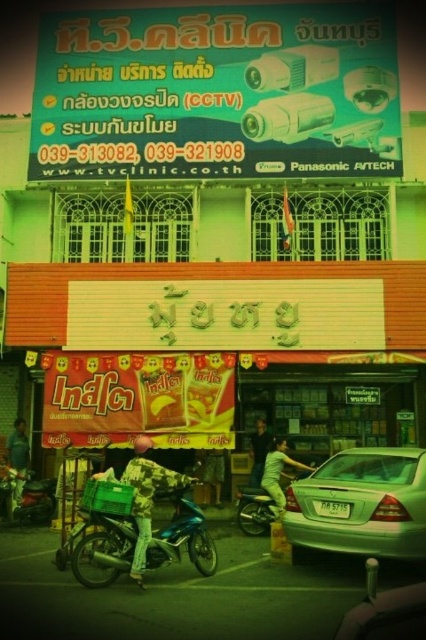
Who is more forward, (11, 515) or (308, 472)?

Point (11, 515) is more forward.

Is point (49, 506) in front of point (252, 493)?

No.

Where is `metallic blue motorcycle at lower left`? The height and width of the screenshot is (640, 426). metallic blue motorcycle at lower left is located at coordinates tap(26, 497).

Who is higher up, metallic silver motorcycle at center or camouflage jacket at lower left?

Positioned higher is camouflage jacket at lower left.

Between metallic silver motorcycle at center and camouflage jacket at lower left, which one is positioned lower?

metallic silver motorcycle at center

At what (x,y) coordinates should I click in order to perform the action: click on metallic silver motorcycle at center. Please return your answer as a coordinate pair (x, y). Looking at the image, I should click on (256, 509).

This screenshot has height=640, width=426. In order to click on metallic silver motorcycle at center in this screenshot , I will do `click(256, 509)`.

Who is positioned more to the right, teal metallic motorcycle at center or metallic blue motorcycle at lower left?

teal metallic motorcycle at center is more to the right.

Looking at this image, is teal metallic motorcycle at center above metallic blue motorcycle at lower left?

A: No, teal metallic motorcycle at center is not above metallic blue motorcycle at lower left.

Which is in front, point (166, 493) or point (5, 472)?

Point (166, 493) is in front.

Where is `teal metallic motorcycle at center`? This screenshot has height=640, width=426. teal metallic motorcycle at center is located at coordinates (103, 541).